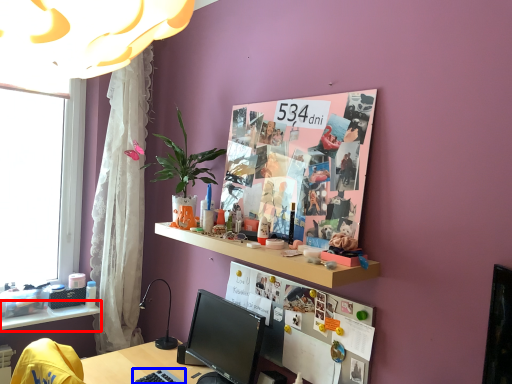
Question: Which of the following is the farthest to the observer, shelf (highlighted by a red box) or keyboard (highlighted by a blue box)?

Choices:
 (A) shelf
 (B) keyboard

Answer: (A)